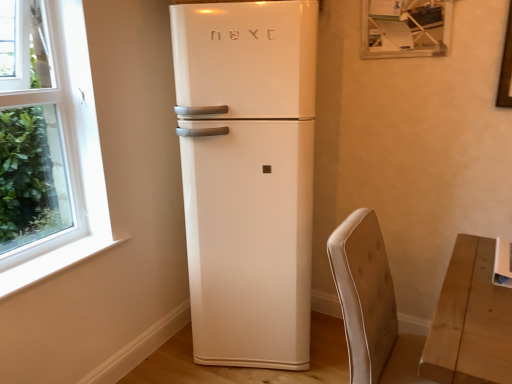
What do you see at coordinates (247, 177) in the screenshot?
I see `white glossy refrigerator at center` at bounding box center [247, 177].

Where is `white glossy refrigerator at center`? Image resolution: width=512 pixels, height=384 pixels. white glossy refrigerator at center is located at coordinates (247, 177).

Describe the element at coordinates (370, 303) in the screenshot. The image size is (512, 384). I see `velvet beige armchair at lower right` at that location.

You are a GUI agent. You are given a task and a screenshot of the screen. Output one action in this format:
    pyautogui.click(x=<x>, y=<y>)
    Task: Click on the velvet beige armchair at lower right
    
    Given the screenshot: What is the action you would take?
    pyautogui.click(x=370, y=303)

The width and height of the screenshot is (512, 384). In order to click on white glossy refrigerator at center in this screenshot , I will do `click(247, 177)`.

Visually, is white glossy refrigerator at center positioned to the left or to the right of velvet beige armchair at lower right?

Based on their positions, white glossy refrigerator at center is located to the left of velvet beige armchair at lower right.

Which is behind, white glossy refrigerator at center or velvet beige armchair at lower right?

white glossy refrigerator at center is further away from the camera.

Which is in front, point (264, 79) or point (349, 288)?

Positioned in front is point (349, 288).

From the image's perspective, who appears lower, white glossy refrigerator at center or velvet beige armchair at lower right?

velvet beige armchair at lower right is shown below in the image.

From a real-world perspective, is white glossy refrigerator at center located higher than velvet beige armchair at lower right?

Yes.

Is white glossy refrigerator at center wider or thinner than velvet beige armchair at lower right?

In the image, white glossy refrigerator at center appears to be wider than velvet beige armchair at lower right.

Between white glossy refrigerator at center and velvet beige armchair at lower right, which one has more height?

white glossy refrigerator at center is taller.

Can you confirm if white glossy refrigerator at center is bigger than velvet beige armchair at lower right?

Correct, white glossy refrigerator at center is larger in size than velvet beige armchair at lower right.

Is velvet beige armchair at lower right a part of white glossy refrigerator at center?

That's incorrect, velvet beige armchair at lower right is not inside white glossy refrigerator at center.

Is white glossy refrigerator at center touching velvet beige armchair at lower right?

No, white glossy refrigerator at center is not making contact with velvet beige armchair at lower right.

Could you tell me if white glossy refrigerator at center is turned towards velvet beige armchair at lower right?

No, white glossy refrigerator at center is not aimed at velvet beige armchair at lower right.

Can you tell me how much white glossy refrigerator at center and velvet beige armchair at lower right differ in facing direction?

65.2 degrees.

The width and height of the screenshot is (512, 384). I want to click on refrigerator lying behind the velvet beige armchair at lower right, so click(247, 177).

From the picture: Can you confirm if velvet beige armchair at lower right is positioned to the right of white glossy refrigerator at center?

Yes.

From the picture: Does velvet beige armchair at lower right lie in front of white glossy refrigerator at center?

Yes, it is.

Is point (378, 333) closer or farther from the camera than point (275, 42)?

Point (378, 333).

From the image's perspective, is velvet beige armchair at lower right over white glossy refrigerator at center?

Actually, velvet beige armchair at lower right appears below white glossy refrigerator at center in the image.

From a real-world perspective, is velvet beige armchair at lower right positioned above or below white glossy refrigerator at center?

Clearly, from a real-world perspective, velvet beige armchair at lower right is below white glossy refrigerator at center.

Which of these two, velvet beige armchair at lower right or white glossy refrigerator at center, is thinner?

With smaller width is velvet beige armchair at lower right.

Can you confirm if velvet beige armchair at lower right is shorter than white glossy refrigerator at center?

Yes.

Does velvet beige armchair at lower right have a larger size compared to white glossy refrigerator at center?

Incorrect, velvet beige armchair at lower right is not larger than white glossy refrigerator at center.

Which is correct: velvet beige armchair at lower right is inside white glossy refrigerator at center, or outside of it?

velvet beige armchair at lower right lies outside white glossy refrigerator at center.

Is velvet beige armchair at lower right far from white glossy refrigerator at center?

No, there isn't a large distance between velvet beige armchair at lower right and white glossy refrigerator at center.

Is velvet beige armchair at lower right aimed at white glossy refrigerator at center?

No, velvet beige armchair at lower right does not turn towards white glossy refrigerator at center.

Find the location of a particular element. This screenshot has height=384, width=512. armchair below the white glossy refrigerator at center (from a real-world perspective) is located at coordinates tap(370, 303).

At what (x,y) coordinates should I click in order to perform the action: click on refrigerator on the left side of velvet beige armchair at lower right. Please return your answer as a coordinate pair (x, y). This screenshot has width=512, height=384. Looking at the image, I should click on (247, 177).

This screenshot has width=512, height=384. Find the location of `armchair that appears on the right of white glossy refrigerator at center`. armchair that appears on the right of white glossy refrigerator at center is located at coordinates (370, 303).